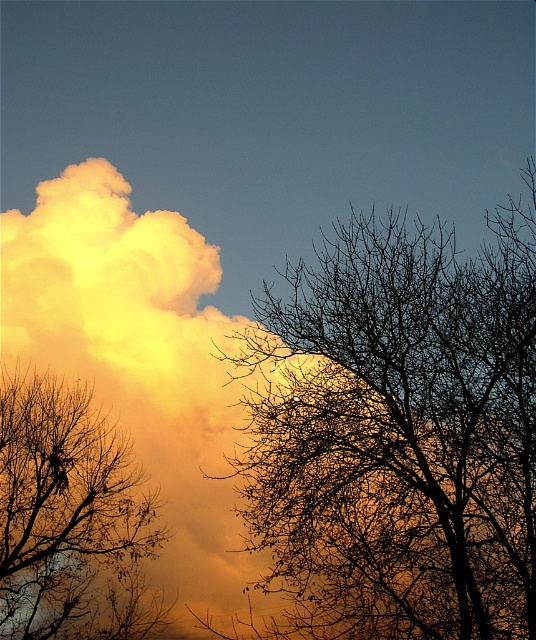
Question: Does silhouette bare tree at center have a greater width compared to silhouette bare branches at left?

Choices:
 (A) no
 (B) yes

Answer: (B)

Question: Is silhouette bare tree at center behind silhouette bare branches at left?

Choices:
 (A) no
 (B) yes

Answer: (A)

Question: In this image, where is silhouette bare tree at center located relative to silhouette bare branches at left?

Choices:
 (A) above
 (B) below

Answer: (A)

Question: Which point appears farthest from the camera in this image?

Choices:
 (A) (26, 540)
 (B) (430, 442)

Answer: (A)

Question: Which point is farther to the camera?

Choices:
 (A) silhouette bare branches at left
 (B) silhouette bare tree at center

Answer: (A)